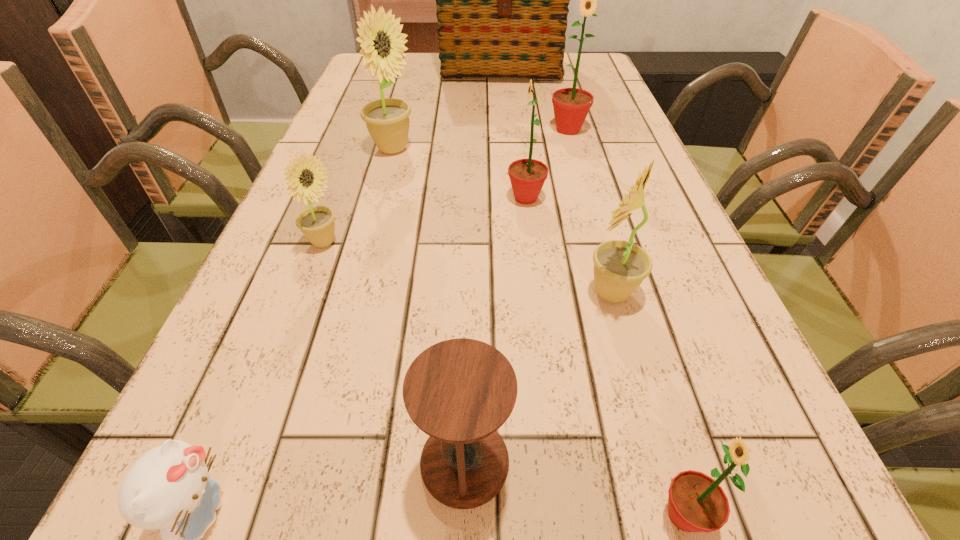
Locate an element on the screen. The image size is (960, 540). free point located 0.330m on the face of the fourth farthest sunflower is located at coordinates pyautogui.click(x=524, y=242).

You are a GUI agent. You are given a task and a screenshot of the screen. Output one action in this format:
    pyautogui.click(x=<x>, y=<y>)
    Task: Click on the vacant area located 0.280m on the right of the hourglass
    
    Given the screenshot: What is the action you would take?
    pyautogui.click(x=743, y=462)

Where is `object located at the far edge`? The image size is (960, 540). object located at the far edge is located at coordinates (502, 0).

At what (x,y) coordinates should I click in order to perform the action: click on shopping bag present at the right edge. Please return your answer as a coordinate pair (x, y). Looking at the image, I should click on (502, 0).

Image resolution: width=960 pixels, height=540 pixels. Find the location of `object that is at the far right corner`. object that is at the far right corner is located at coordinates click(502, 0).

You are a GUI agent. You are given a task and a screenshot of the screen. Output one action in this format:
    pyautogui.click(x=<x>, y=<y>)
    Task: Click on the vacant region at the far edge of the desktop
    The image size is (960, 540).
    Given the screenshot: What is the action you would take?
    pyautogui.click(x=433, y=58)

In the image, there is a desktop. Where is `free region at the left edge`? free region at the left edge is located at coordinates (350, 94).

In the image, there is a desktop. Where is `vacant space at the right edge`? The image size is (960, 540). vacant space at the right edge is located at coordinates (720, 428).

Locate an element on the screen. The height and width of the screenshot is (540, 960). vacant space at the far right corner is located at coordinates (574, 57).

At what (x,y) coordinates should I click in order to perform the action: click on empty space that is in between the biggest green sunflower and the sixth farthest object. Please return your answer as a coordinate pair (x, y). Looking at the image, I should click on click(x=589, y=211).